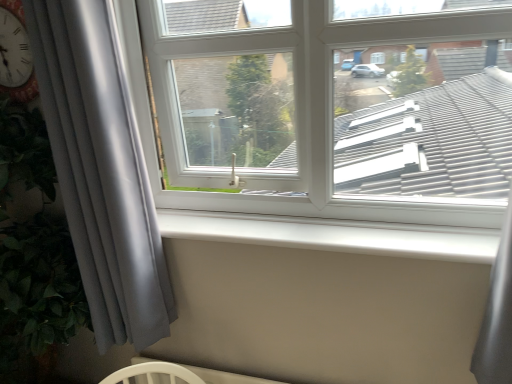
Question: Are white smooth window sill at center and white plastic window at center located far from each other?

Choices:
 (A) no
 (B) yes

Answer: (A)

Question: Is white smooth window sill at center bigger than white plastic window at center?

Choices:
 (A) no
 (B) yes

Answer: (A)

Question: From a real-world perspective, is white smooth window sill at center on white plastic window at center?

Choices:
 (A) yes
 (B) no

Answer: (B)

Question: Considering the relative sizes of white smooth window sill at center and white plastic window at center in the image provided, is white smooth window sill at center wider than white plastic window at center?

Choices:
 (A) no
 (B) yes

Answer: (A)

Question: Is white smooth window sill at center outside of white plastic window at center?

Choices:
 (A) no
 (B) yes

Answer: (B)

Question: From their relative heights in the image, would you say white smooth window sill at center is taller or shorter than white plastic window at center?

Choices:
 (A) tall
 (B) short

Answer: (B)

Question: Considering the positions of point (361, 253) and point (264, 94), is point (361, 253) closer or farther from the camera than point (264, 94)?

Choices:
 (A) farther
 (B) closer

Answer: (B)

Question: Considering their positions, is white smooth window sill at center located in front of or behind white plastic window at center?

Choices:
 (A) behind
 (B) front

Answer: (A)

Question: Is white smooth window sill at center bigger or smaller than white plastic window at center?

Choices:
 (A) small
 (B) big

Answer: (A)

Question: Is gray matte curtain at left in front of or behind white plastic window at center in the image?

Choices:
 (A) front
 (B) behind

Answer: (B)

Question: Looking at their shapes, would you say gray matte curtain at left is wider or thinner than white plastic window at center?

Choices:
 (A) wide
 (B) thin

Answer: (B)

Question: Considering the positions of point (56, 11) and point (153, 48), is point (56, 11) closer or farther from the camera than point (153, 48)?

Choices:
 (A) farther
 (B) closer

Answer: (B)

Question: Considering the relative positions of gray matte curtain at left and white plastic window at center in the image provided, is gray matte curtain at left to the left or to the right of white plastic window at center?

Choices:
 (A) left
 (B) right

Answer: (A)

Question: Considering the positions of white smooth window sill at center and gray matte curtain at left in the image, is white smooth window sill at center wider or thinner than gray matte curtain at left?

Choices:
 (A) thin
 (B) wide

Answer: (A)

Question: From the image's perspective, relative to gray matte curtain at left, is white smooth window sill at center above or below?

Choices:
 (A) below
 (B) above

Answer: (A)